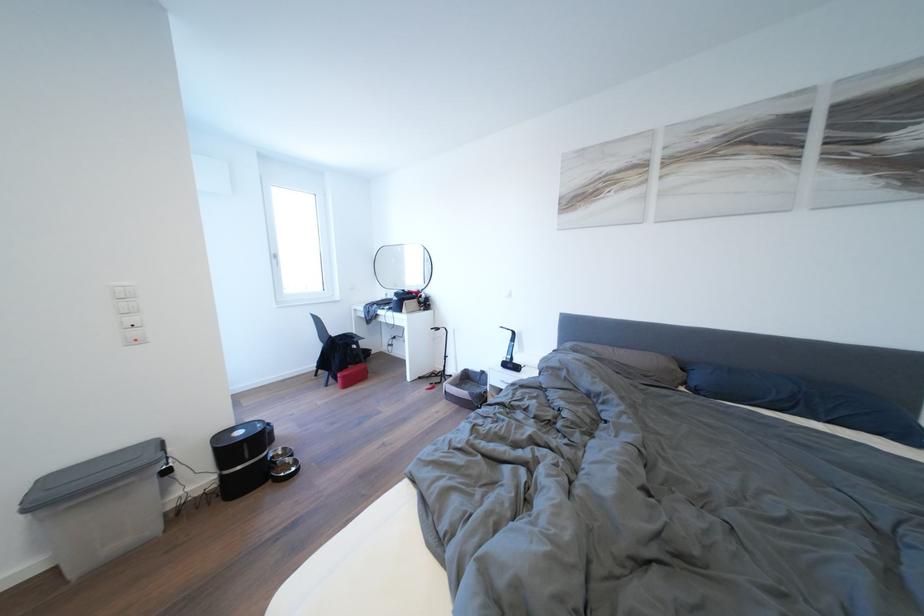
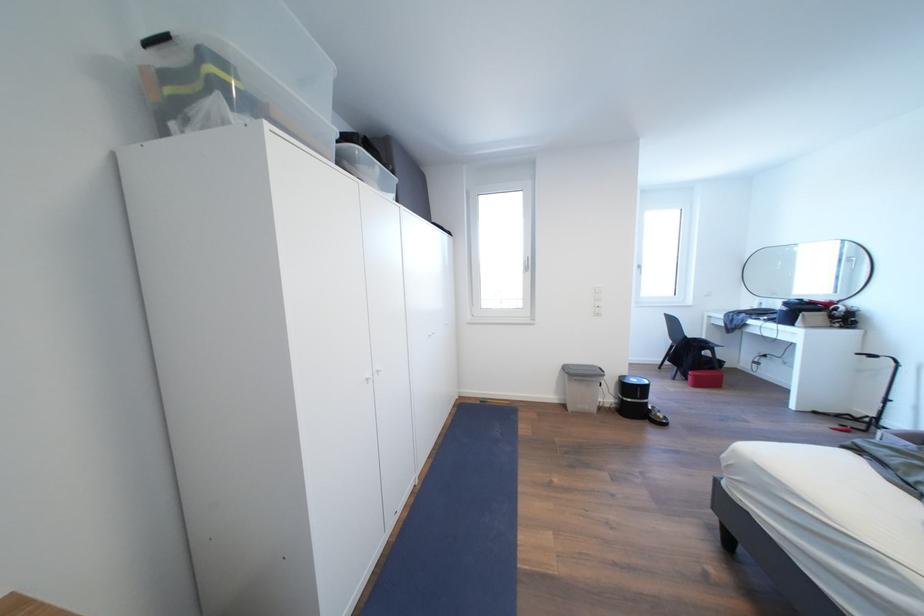
Find the pixel in the second image that matches point (248, 438) in the first image.

(641, 386)